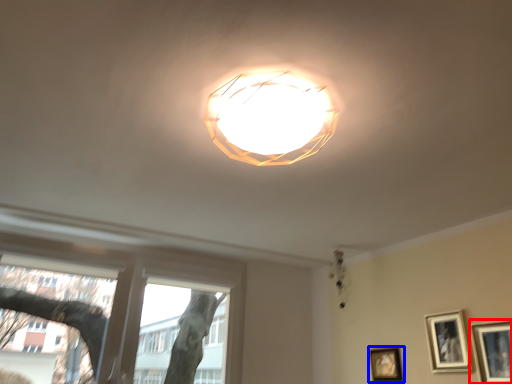
Question: Which point is further to the camera, picture frame (highlighted by a red box) or picture frame (highlighted by a blue box)?

Choices:
 (A) picture frame
 (B) picture frame

Answer: (B)